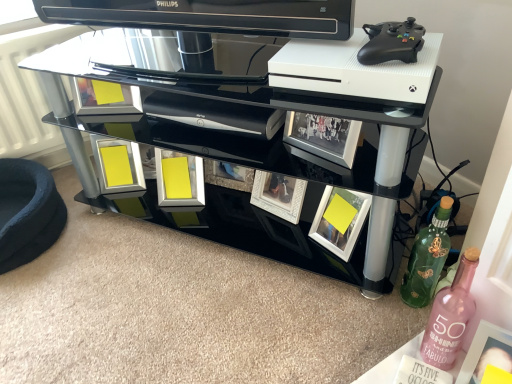
Find the location of a particular element. vacant area that lies between green matte bottle at lower right, acting as the second bottle starting from the front, and velvet cushion at lower left is located at coordinates (183, 260).